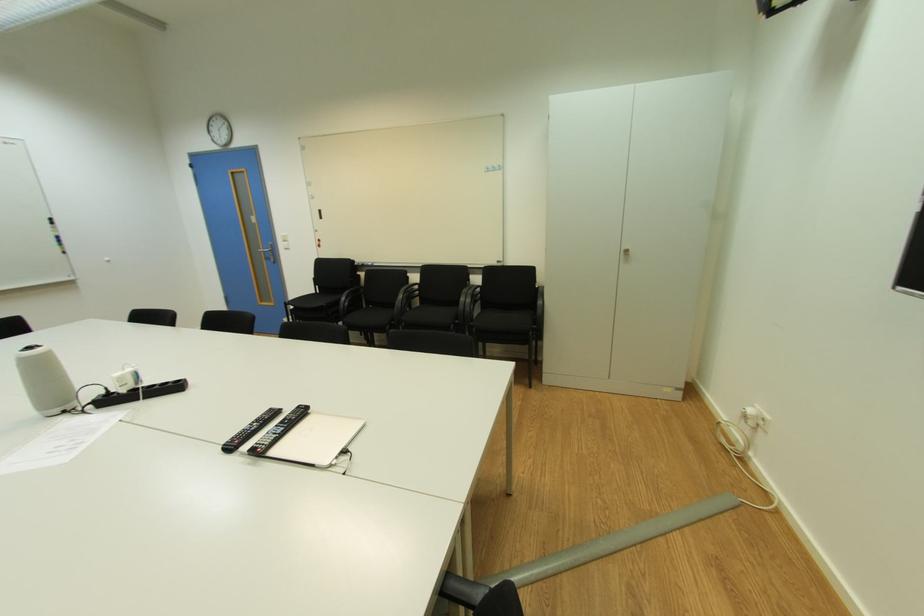
Find where to lift the black remote control. Please return your answer as a coordinate pair (x, y).

(249, 430)